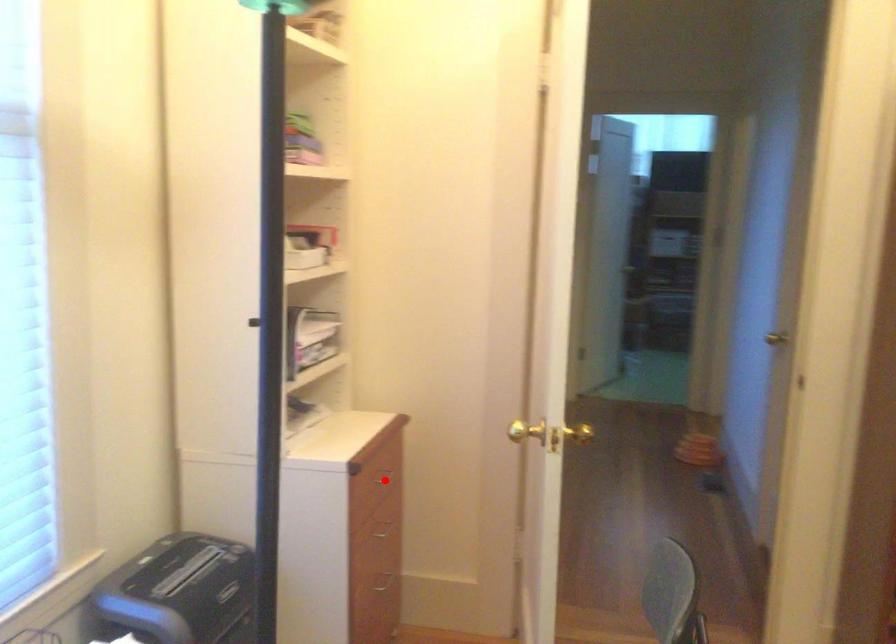
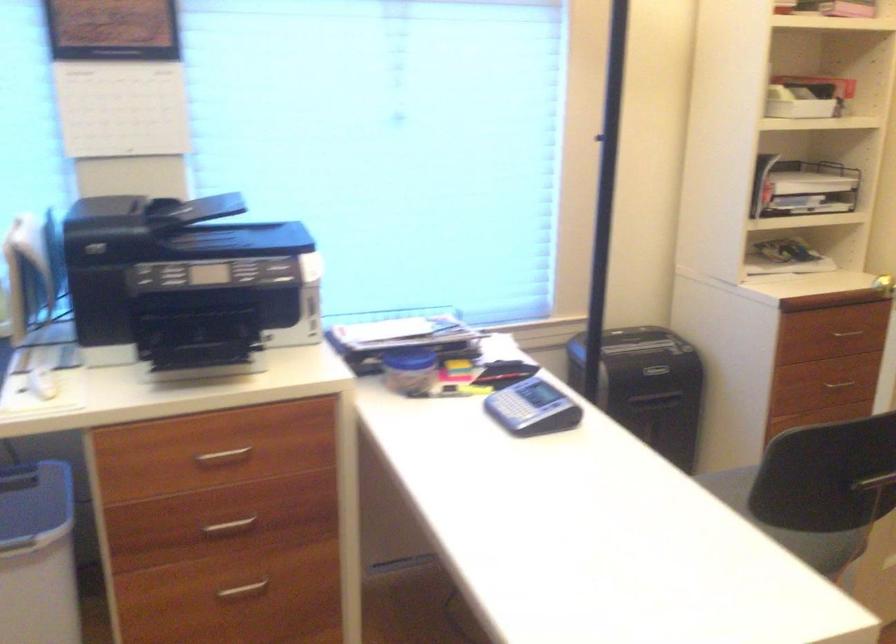
Find the pixel in the second image that matches the highlighted location in the first image.

(847, 333)